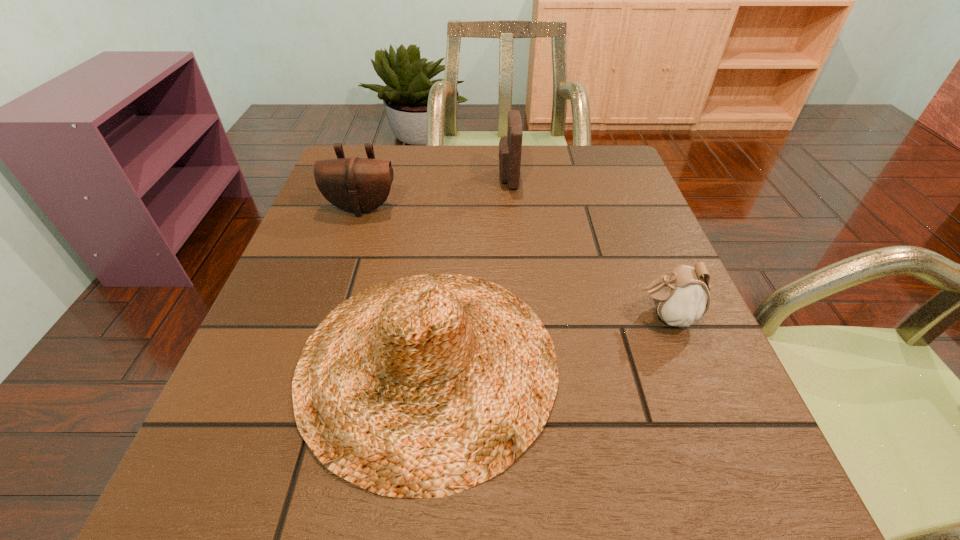
Locate an element on the screen. pouch object that ranks as the closest to the leftmost pouch is located at coordinates (510, 146).